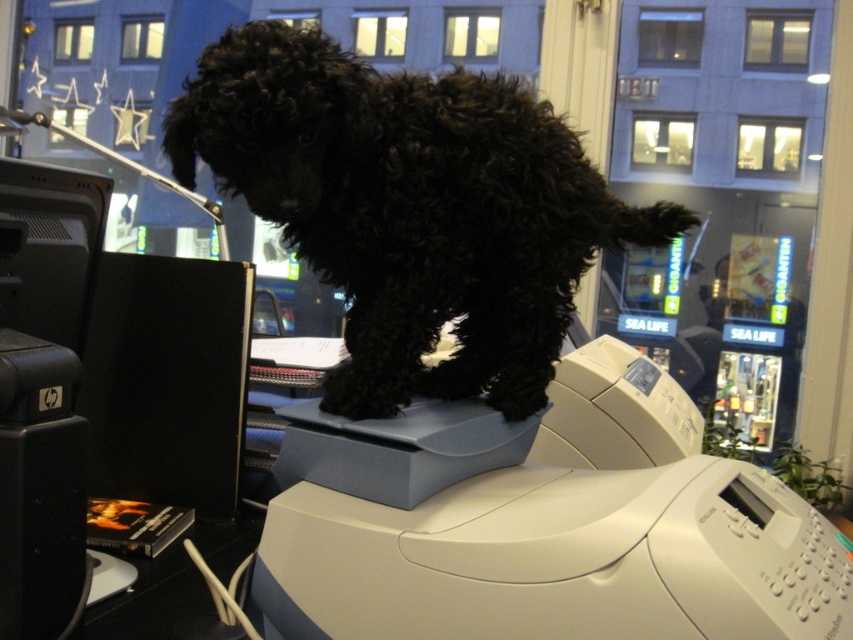
Question: Is black curly fur dog at center smaller than white plastic printer at upper center?

Choices:
 (A) yes
 (B) no

Answer: (B)

Question: Considering the real-world distances, which object is closest to the black curly fur dog at center?

Choices:
 (A) white plastic printer at upper center
 (B) black fuzzy paw at center

Answer: (B)

Question: Does black curly fur dog at center have a greater width compared to white plastic printer at upper center?

Choices:
 (A) yes
 (B) no

Answer: (A)

Question: Which of the following is the farthest from the observer?

Choices:
 (A) (763, 497)
 (B) (387, 221)

Answer: (B)

Question: Is black curly fur dog at center above black fuzzy paw at center?

Choices:
 (A) yes
 (B) no

Answer: (A)

Question: Estimate the real-world distances between objects in this image. Which object is farther from the black curly fur dog at center?

Choices:
 (A) white plastic printer at upper center
 (B) black fuzzy paw at center

Answer: (A)